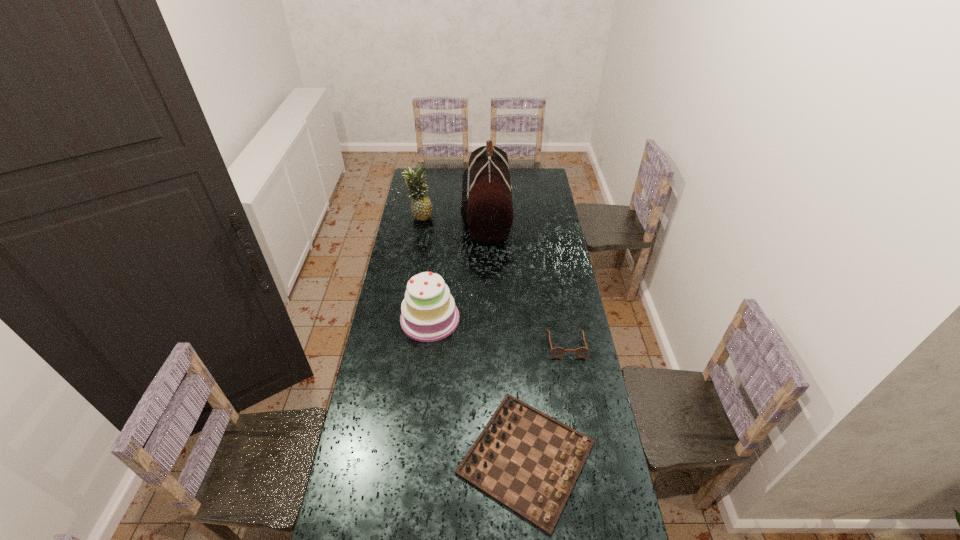
The image size is (960, 540). Find the location of `the tallest object`. the tallest object is located at coordinates (486, 207).

Image resolution: width=960 pixels, height=540 pixels. I want to click on pineapple, so pos(421,207).

The width and height of the screenshot is (960, 540). Find the location of `cake`. cake is located at coordinates (428, 313).

Find the location of `the nearest object`. the nearest object is located at coordinates (528, 461).

At what (x,y) coordinates should I click in order to perform the action: click on chessboard. Please return your answer as a coordinate pair (x, y). The width and height of the screenshot is (960, 540). Looking at the image, I should click on (528, 461).

Locate an element on the screen. the shortest object is located at coordinates (557, 352).

Identify the location of free space located 0.160m on the front pocket of the tallest object. This screenshot has height=540, width=960. (433, 214).

Identify the location of vacant space located on the front pocket of the tallest object. (449, 214).

Locate an element on the screen. The image size is (960, 540). vacant space situated 0.130m on the front pocket of the tallest object is located at coordinates tap(439, 214).

Identify the location of vacant space located 0.320m on the front of the pineapple. Image resolution: width=960 pixels, height=540 pixels. (413, 262).